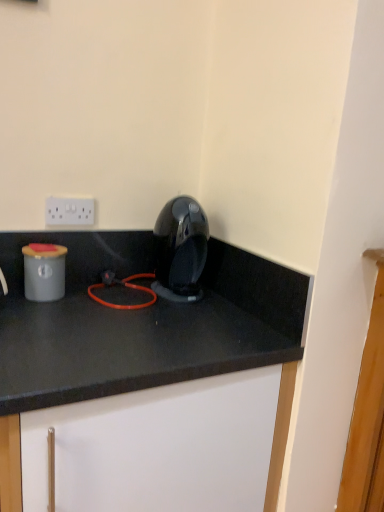
Image resolution: width=384 pixels, height=512 pixels. What do you see at coordinates (69, 211) in the screenshot?
I see `white plastic electric outlet at upper center` at bounding box center [69, 211].

In order to face white matte cabinet at center, should I rotate leftwards or rightwards?

To align with it, rotate left about 8.823°.

The height and width of the screenshot is (512, 384). I want to click on white plastic electric outlet at upper center, so (69, 211).

From a real-world perspective, is white plastic electric outlet at upper center positioned under glossy plastic coffee machine at center based on gravity?

No.

Would you consider white plastic electric outlet at upper center to be distant from glossy plastic coffee machine at center?

white plastic electric outlet at upper center is actually quite close to glossy plastic coffee machine at center.

Is white plastic electric outlet at upper center oriented towards glossy plastic coffee machine at center?

No.

From the picture: Which of these two, white plastic electric outlet at upper center or glossy plastic coffee machine at center, stands taller?

glossy plastic coffee machine at center.

Considering the relative sizes of glossy plastic coffee machine at center and white plastic electric outlet at upper center in the image provided, is glossy plastic coffee machine at center bigger than white plastic electric outlet at upper center?

Correct, glossy plastic coffee machine at center is larger in size than white plastic electric outlet at upper center.

Do you think glossy plastic coffee machine at center is within white plastic electric outlet at upper center, or outside of it?

glossy plastic coffee machine at center lies outside white plastic electric outlet at upper center.

This screenshot has width=384, height=512. Identify the location of home appliance lying in front of the white plastic electric outlet at upper center. (180, 250).

In terms of width, does glossy plastic coffee machine at center look wider or thinner when compared to white plastic electric outlet at upper center?

In the image, glossy plastic coffee machine at center appears to be wider than white plastic electric outlet at upper center.

Between matte gray container at left and white plastic electric outlet at upper center, which one has larger size?

matte gray container at left is bigger.

How distant is matte gray container at left from white plastic electric outlet at upper center?

The distance of matte gray container at left from white plastic electric outlet at upper center is 7.32 inches.

In terms of height, does matte gray container at left look taller or shorter compared to white plastic electric outlet at upper center?

Clearly, matte gray container at left is taller compared to white plastic electric outlet at upper center.

Which object is positioned more to the left, matte gray container at left or white plastic electric outlet at upper center?

matte gray container at left is more to the left.

Is matte gray container at left touching glossy plastic coffee machine at center?

No, matte gray container at left is not in contact with glossy plastic coffee machine at center.

From a real-world perspective, is matte gray container at left positioned over glossy plastic coffee machine at center based on gravity?

Actually, matte gray container at left is physically below glossy plastic coffee machine at center in the real world.

Is matte gray container at left aimed at glossy plastic coffee machine at center?

No, matte gray container at left does not turn towards glossy plastic coffee machine at center.

From a real-world perspective, which object stands above the other?

From a 3D spatial view, white plastic electric outlet at upper center is above.

Which of these two, white plastic electric outlet at upper center or matte gray container at left, is smaller?

white plastic electric outlet at upper center.

Is point (81, 223) positioned before point (38, 293)?

That is False.

In the scene shown: Which object is more forward, white plastic electric outlet at upper center or matte gray container at left?

matte gray container at left is more forward.

Is white matte cabinet at center oriented away from glossy plastic coffee machine at center?

white matte cabinet at center does not have its back to glossy plastic coffee machine at center.

Find the location of `cabinetry that is below the glossy plastic coffee machine at center (from the image's perspective)`. cabinetry that is below the glossy plastic coffee machine at center (from the image's perspective) is located at coordinates (140, 322).

Considering the positions of objects white matte cabinet at center and glossy plastic coffee machine at center in the image provided, who is behind, white matte cabinet at center or glossy plastic coffee machine at center?

glossy plastic coffee machine at center is behind.

Are white matte cabinet at center and glossy plastic coffee machine at center located far from each other?

No, white matte cabinet at center is not far away from glossy plastic coffee machine at center.

Is glossy plastic coffee machine at center positioned beyond the bounds of matte gray container at left?

Absolutely, glossy plastic coffee machine at center is external to matte gray container at left.

From the image's perspective, would you say glossy plastic coffee machine at center is shown under matte gray container at left?

No, from the image's perspective, glossy plastic coffee machine at center is not below matte gray container at left.

The height and width of the screenshot is (512, 384). In order to click on home appliance on the right of matte gray container at left in this screenshot , I will do `click(180, 250)`.

Can you confirm if glossy plastic coffee machine at center is shorter than matte gray container at left?

Incorrect, the height of glossy plastic coffee machine at center does not fall short of that of matte gray container at left.

This screenshot has width=384, height=512. Find the location of `home appliance lying on the right of white plastic electric outlet at upper center`. home appliance lying on the right of white plastic electric outlet at upper center is located at coordinates (180, 250).

Locate an element on the screen. This screenshot has height=512, width=384. home appliance that appears in front of the white plastic electric outlet at upper center is located at coordinates (180, 250).

Based on their spatial positions, is matte gray container at left or white matte cabinet at center closer to glossy plastic coffee machine at center?

white matte cabinet at center is closer to glossy plastic coffee machine at center.

From the image, which object appears to be nearer to white plastic electric outlet at upper center, matte gray container at left or glossy plastic coffee machine at center?

Among the two, matte gray container at left is located nearer to white plastic electric outlet at upper center.

Considering their positions, is glossy plastic coffee machine at center positioned further to white plastic electric outlet at upper center than matte gray container at left?

glossy plastic coffee machine at center lies further to white plastic electric outlet at upper center than the other object.

Based on their spatial positions, is matte gray container at left or glossy plastic coffee machine at center further from white matte cabinet at center?

Based on the image, matte gray container at left appears to be further to white matte cabinet at center.

Based on the photo, estimate the real-world distances between objects in this image. Which object is further from glossy plastic coffee machine at center, matte gray container at left or white plastic electric outlet at upper center?

Based on the image, matte gray container at left appears to be further to glossy plastic coffee machine at center.

Which object lies further to the anchor point matte gray container at left, white matte cabinet at center or glossy plastic coffee machine at center?

The object further to matte gray container at left is glossy plastic coffee machine at center.

Which object lies further to the anchor point white matte cabinet at center, matte gray container at left or white plastic electric outlet at upper center?

white plastic electric outlet at upper center lies further to white matte cabinet at center than the other object.

Based on their spatial positions, is glossy plastic coffee machine at center or white plastic electric outlet at upper center closer to matte gray container at left?

Based on the image, white plastic electric outlet at upper center appears to be nearer to matte gray container at left.

Identify the location of appliance between glossy plastic coffee machine at center and white matte cabinet at center in the vertical direction. (44, 272).

You are a GUI agent. You are given a task and a screenshot of the screen. Output one action in this format:
    pyautogui.click(x=<x>, y=<y>)
    Task: Click on the appliance between white plastic electric outlet at upper center and white matte cabinet at center vertically
    This screenshot has width=384, height=512.
    Given the screenshot: What is the action you would take?
    pyautogui.click(x=44, y=272)

The height and width of the screenshot is (512, 384). I want to click on home appliance between white plastic electric outlet at upper center and white matte cabinet at center vertically, so click(180, 250).

Image resolution: width=384 pixels, height=512 pixels. What are the coordinates of `electric outlet between matte gray container at left and glossy plastic coffee machine at center from left to right` in the screenshot? It's located at (69, 211).